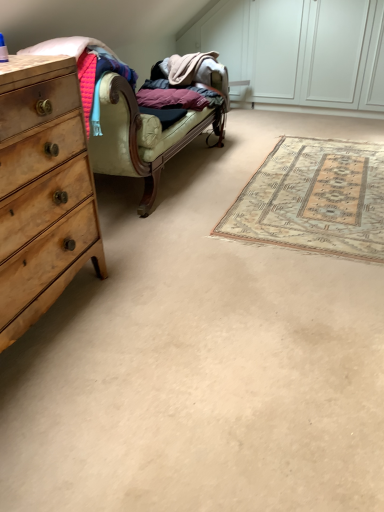
This screenshot has width=384, height=512. What do you see at coordinates (147, 127) in the screenshot?
I see `velvet green couch at center` at bounding box center [147, 127].

What is the approximate width of beige woven rug at center?

beige woven rug at center is 2.03 meters wide.

What is the approximate height of wooden chest of drawers at left?

95.12 centimeters.

Where is `velvet green couch at center`? Image resolution: width=384 pixels, height=512 pixels. velvet green couch at center is located at coordinates (147, 127).

Is velvet green couch at center thinner than wooden chest of drawers at left?

No, velvet green couch at center is not thinner than wooden chest of drawers at left.

Looking at this image, is velvet green couch at center positioned with its back to wooden chest of drawers at left?

No, wooden chest of drawers at left is not at the back of velvet green couch at center.

Which is behind, point (123, 129) or point (40, 231)?

The point (123, 129) is farther.

Is velvet green couch at center taller or shorter than wooden chest of drawers at left?

Clearly, velvet green couch at center is shorter compared to wooden chest of drawers at left.

Considering the sizes of objects velvet green couch at center and beige woven rug at center in the image provided, who is bigger, velvet green couch at center or beige woven rug at center?

With larger size is velvet green couch at center.

Find the location of `studio couch above the beige woven rug at center (from a real-world perspective)`. studio couch above the beige woven rug at center (from a real-world perspective) is located at coordinates (147, 127).

From their relative heights in the image, would you say velvet green couch at center is taller or shorter than beige woven rug at center?

velvet green couch at center is taller than beige woven rug at center.

In the image, there is a velvet green couch at center. What are the coordinates of `mat below it (from the image's perspective)` in the screenshot? It's located at point(314,199).

Is beige woven rug at center positioned with its back to velvet green couch at center?

beige woven rug at center does not have its back to velvet green couch at center.

Based on the photo, from their relative heights in the image, would you say beige woven rug at center is taller or shorter than velvet green couch at center?

In the image, beige woven rug at center appears to be shorter than velvet green couch at center.

Is beige woven rug at center surrounding velvet green couch at center?

No, velvet green couch at center is not a part of beige woven rug at center.

From the picture: From the image's perspective, which is above, wooden chest of drawers at left or velvet green couch at center?

velvet green couch at center is shown above in the image.

Considering the relative positions of wooden chest of drawers at left and velvet green couch at center in the image provided, is wooden chest of drawers at left in front of velvet green couch at center?

That is True.

What's the angular difference between wooden chest of drawers at left and velvet green couch at center's facing directions?

The angle between the facing direction of wooden chest of drawers at left and the facing direction of velvet green couch at center is 0.000753 degrees.

Between wooden chest of drawers at left and velvet green couch at center, which one has smaller size?

wooden chest of drawers at left is smaller.

In terms of height, does wooden chest of drawers at left look taller or shorter compared to beige woven rug at center?

wooden chest of drawers at left is taller than beige woven rug at center.

Could you tell me if wooden chest of drawers at left is turned towards beige woven rug at center?

No, wooden chest of drawers at left is not oriented towards beige woven rug at center.

Identify the location of mat that appears below the wooden chest of drawers at left (from a real-world perspective). (314, 199).

In the scene shown: Between wooden chest of drawers at left and beige woven rug at center, which one is positioned behind?

beige woven rug at center.

From a real-world perspective, is beige woven rug at center positioned over wooden chest of drawers at left based on gravity?

No, from a real-world perspective, beige woven rug at center is not over wooden chest of drawers at left

Consider the image. From the image's perspective, is beige woven rug at center located above or below wooden chest of drawers at left?

beige woven rug at center is situated higher than wooden chest of drawers at left in the image.

Would you say beige woven rug at center is outside wooden chest of drawers at left?

Yes, beige woven rug at center is located beyond the bounds of wooden chest of drawers at left.

At what (x,y) coordinates should I click in order to perform the action: click on the chest of drawers below the velvet green couch at center (from the image's perspective). Please return your answer as a coordinate pair (x, y). Looking at the image, I should click on (43, 195).

Where is `mat below the velvet green couch at center (from a real-world perspective)`? The width and height of the screenshot is (384, 512). mat below the velvet green couch at center (from a real-world perspective) is located at coordinates [314, 199].

In the scene shown: Estimate the real-world distances between objects in this image. Which object is closer to beige woven rug at center, velvet green couch at center or wooden chest of drawers at left?

Based on the image, velvet green couch at center appears to be nearer to beige woven rug at center.

Estimate the real-world distances between objects in this image. Which object is further from wooden chest of drawers at left, velvet green couch at center or beige woven rug at center?

beige woven rug at center.

From the image, which object appears to be farther from wooden chest of drawers at left, beige woven rug at center or velvet green couch at center?

Based on the image, beige woven rug at center appears to be further to wooden chest of drawers at left.

Which object lies further to the anchor point velvet green couch at center, beige woven rug at center or wooden chest of drawers at left?

The object further to velvet green couch at center is wooden chest of drawers at left.

Looking at the image, which one is located closer to beige woven rug at center, wooden chest of drawers at left or velvet green couch at center?

Based on the image, velvet green couch at center appears to be nearer to beige woven rug at center.

Estimate the real-world distances between objects in this image. Which object is closer to velvet green couch at center, wooden chest of drawers at left or beige woven rug at center?

beige woven rug at center is closer to velvet green couch at center.

Locate an element on the screen. The width and height of the screenshot is (384, 512). studio couch between wooden chest of drawers at left and beige woven rug at center in the horizontal direction is located at coordinates (147, 127).